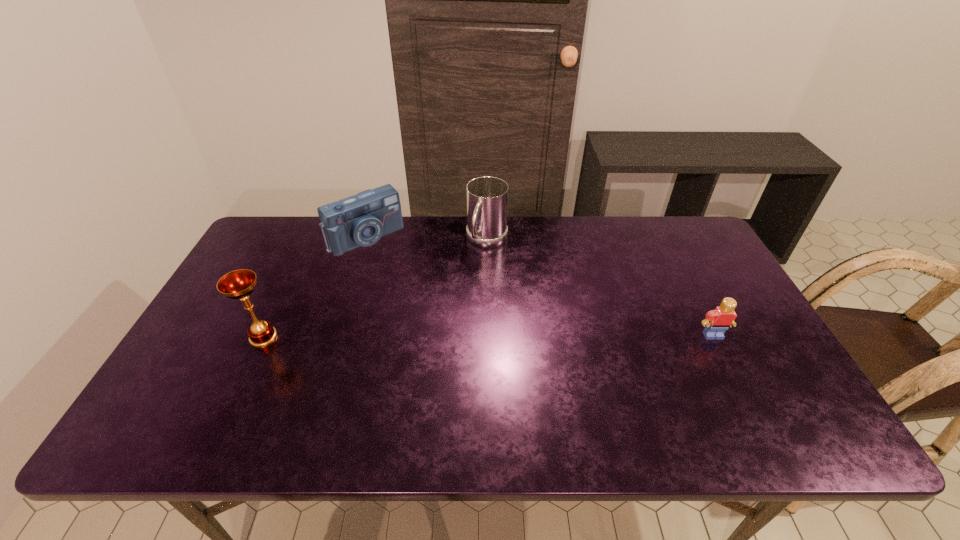
Where is `vacant space at the far left corner`? vacant space at the far left corner is located at coordinates (276, 255).

Identify the location of blank area at the far right corner. The height and width of the screenshot is (540, 960). (685, 258).

The width and height of the screenshot is (960, 540). Identify the location of vacant area that lies between the rightmost object and the camera. (540, 286).

The image size is (960, 540). Find the location of `free space between the leftmost object and the third object from right to left`. free space between the leftmost object and the third object from right to left is located at coordinates (315, 287).

Identify the location of free area in between the rightmost object and the third object from left to right. Image resolution: width=960 pixels, height=540 pixels. (600, 288).

Find the location of a particular element. The height and width of the screenshot is (540, 960). vacant space that's between the camera and the mug is located at coordinates (426, 240).

The height and width of the screenshot is (540, 960). I want to click on free area in between the second object from left to right and the leftmost object, so point(315,287).

Where is `free area in between the leftmost object and the shortest object`? This screenshot has width=960, height=540. free area in between the leftmost object and the shortest object is located at coordinates (488, 336).

The height and width of the screenshot is (540, 960). Find the location of `free space between the leftmost object and the camera`. free space between the leftmost object and the camera is located at coordinates (315, 287).

Where is `empty space between the third object from right to left and the leftmost object`? The height and width of the screenshot is (540, 960). empty space between the third object from right to left and the leftmost object is located at coordinates (315, 287).